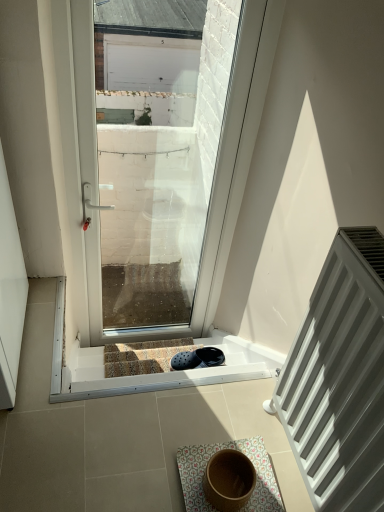
Question: From a real-world perspective, is white matte radiator at right physically located above or below floral fabric bath mat at center?

Choices:
 (A) below
 (B) above

Answer: (B)

Question: Which is correct: white matte radiator at right is inside floral fabric bath mat at center, or outside of it?

Choices:
 (A) outside
 (B) inside

Answer: (A)

Question: Which of these objects is positioned farthest from the transparent glass door at center?

Choices:
 (A) carpeted stairs at center
 (B) floral fabric bath mat at center
 (C) white matte radiator at right

Answer: (B)

Question: Which object is the closest to the white matte radiator at right?

Choices:
 (A) carpeted stairs at center
 (B) transparent glass door at center
 (C) floral fabric bath mat at center

Answer: (C)